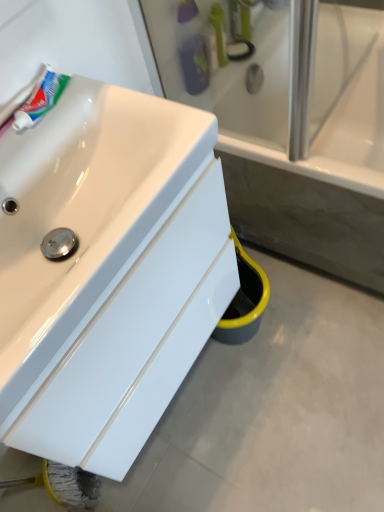
The height and width of the screenshot is (512, 384). What are the coordinates of `empty space that is to the right of white glossy tube at upper left` in the screenshot? It's located at (108, 99).